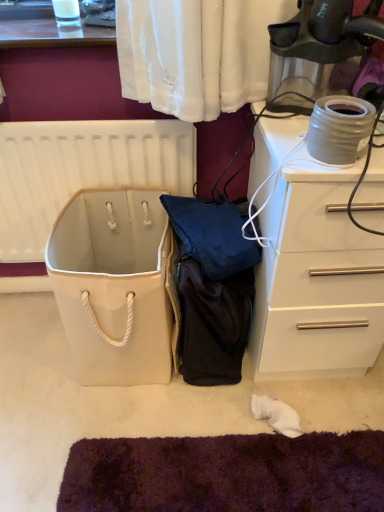
This screenshot has height=512, width=384. I want to click on vacant area to the left of matte gray ceramic pot at upper right, so click(x=287, y=155).